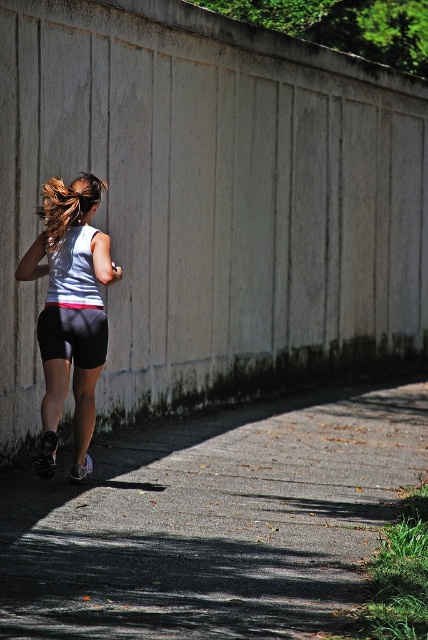
You are a photographer trying to capture the jogger in the image. To ensure the entire gray asphalt pavement at lower center and the gray matte shorts at center are visible in the frame, which object should you focus on to adjust your camera angle?

The gray asphalt pavement at lower center is wider than the gray matte shorts at center, so focusing on the gray asphalt pavement at lower center will help adjust the camera angle to include both objects in the frame.

You are a photographer trying to capture the jogger in the image. You want to ensure that both the gray asphalt pavement at lower center and the white matte shorts at center are clearly visible in your shot. Given their sizes, which object should you focus on to ensure both are in frame?

The gray asphalt pavement at lower center is bigger than the white matte shorts at center, so focusing on the gray asphalt pavement at lower center would ensure both are in frame since it occupies more space.

You are a photographer trying to capture the jogger in the image. You want to focus on the point at the jogger that is closer to the camera. Which point should you focus on, point [86,320] or point [77,216]?

Point [86,320] is closer to the camera than point [77,216], so you should focus on point [86,320].